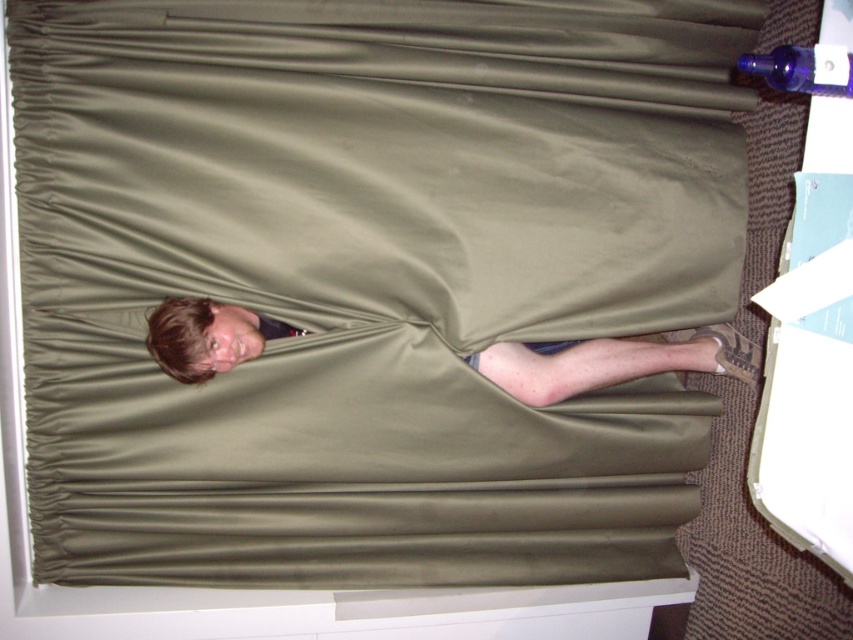
You are standing in a room where a person is partially hidden behind a large curtain. You notice a point marked at coordinates (612, 362). What object is located at that point?

The object at point (612, 362) is the matte olive green fabric at lower center.

Consider the image. You are standing in a room and want to reach the matte olive green fabric at lower center. Considering your height is 1.7 meters, can you comfortably touch it without stretching?

The matte olive green fabric at lower center is 2.09 meters away from the camera. Since your height is 1.7 meters, you can comfortably touch it without stretching as the distance is greater than your height.